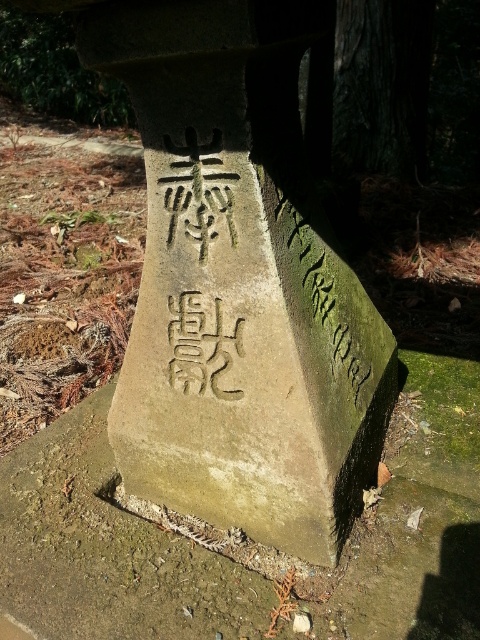
In the scene shown: Does green stone marker at center appear on the left side of green mossy stone at center?

Yes, green stone marker at center is to the left of green mossy stone at center.

Who is higher up, green stone marker at center or green mossy stone at center?

Positioned higher is green mossy stone at center.

Which is in front, point (421, 355) or point (280, 243)?

Point (280, 243) is in front.

Locate an element on the screen. green stone marker at center is located at coordinates (107, 550).